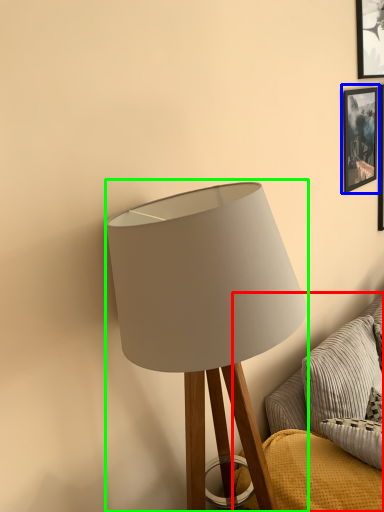
Question: Estimate the real-world distances between objects in this image. Which object is farther from couch (highlighted by a red box), picture frame (highlighted by a blue box) or lamp (highlighted by a green box)?

Choices:
 (A) picture frame
 (B) lamp

Answer: (A)